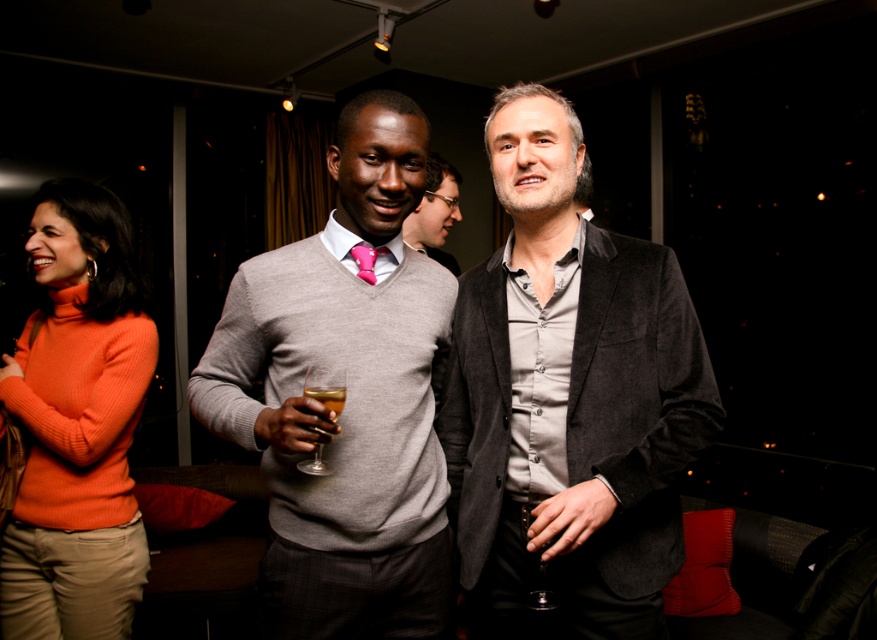
You are a photographer at this event and want to take a closeup shot of the velvet black blazer at center without the matte gray sweater at center appearing in the background. Is this possible given their positions?

The velvet black blazer at center is further to the viewer than the matte gray sweater at center, so yes, you can take a closeup shot of the velvet black blazer at center without the matte gray sweater at center appearing in the background because it is closer to you and the other is behind it.

In the scene shown: What is the object located at the coordinates point (568, 397) in the image?

The object at point (568, 397) is the velvet black blazer at center.